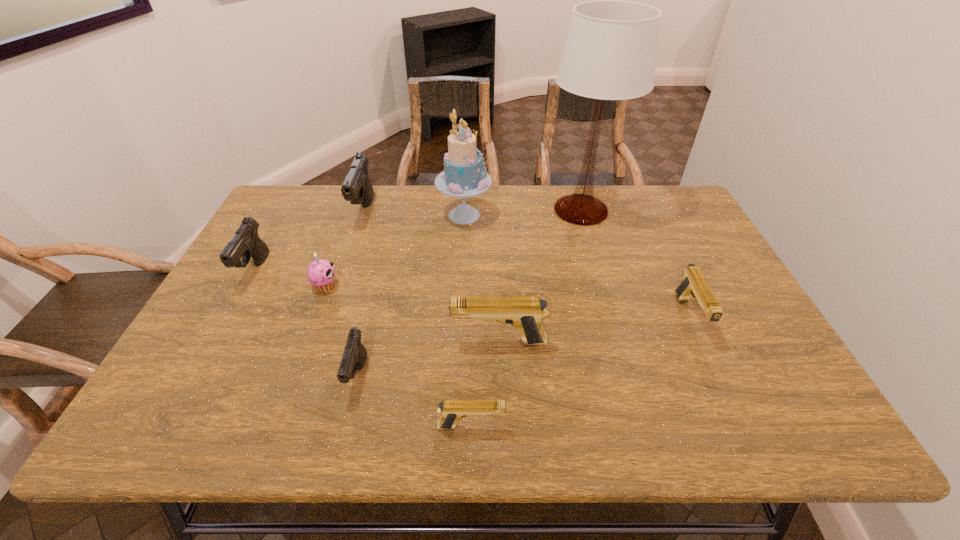
At what (x,y) coordinates should I click in order to perform the action: click on vacant space located at the barrel of the biggest tan pistol. Please return your answer as a coordinate pair (x, y). Looking at the image, I should click on (298, 342).

The width and height of the screenshot is (960, 540). Find the location of `free space located at the barrel of the biggest tan pistol`. free space located at the barrel of the biggest tan pistol is located at coordinates (311, 342).

The image size is (960, 540). What are the coordinates of `vacant region located at the barrel of the second smallest black pistol` in the screenshot? It's located at (231, 313).

The image size is (960, 540). In order to click on blank space located on the face of the cupcake in this screenshot , I will do `click(489, 286)`.

At what (x,y) coordinates should I click in order to perform the action: click on vacant space located at the barrel of the rightmost pistol. Please return your answer as a coordinate pair (x, y). The image size is (960, 540). Looking at the image, I should click on (739, 425).

Find the location of a particular element. vacant space located 0.090m at the barrel of the shortest pistol is located at coordinates (550, 427).

Locate an element on the screen. table lamp present at the far edge is located at coordinates (610, 51).

At what (x,y) coordinates should I click in order to perform the action: click on cake positioned at the far edge. Please return your answer as a coordinate pair (x, y). Looking at the image, I should click on (464, 175).

The height and width of the screenshot is (540, 960). Identify the location of pistol that is at the far edge. (357, 188).

The height and width of the screenshot is (540, 960). Identify the location of object present at the left edge. (246, 243).